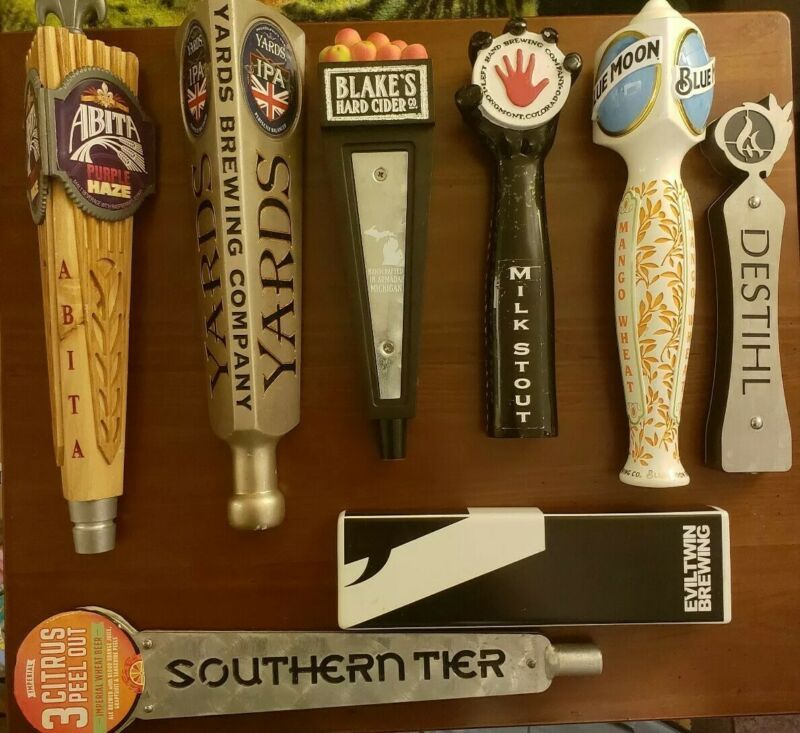
Identify the location of beer tap handles. (262, 671), (80, 349), (260, 319), (385, 286), (514, 298), (658, 290), (758, 298).